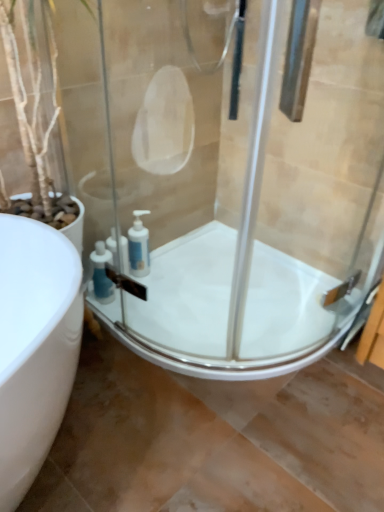
You are a GUI agent. You are given a task and a screenshot of the screen. Output one action in this format:
    pyautogui.click(x=<x>, y=<y>)
    Task: Click on the free space in front of transparent glass shower door at center
    
    Given the screenshot: What is the action you would take?
    pyautogui.click(x=142, y=424)